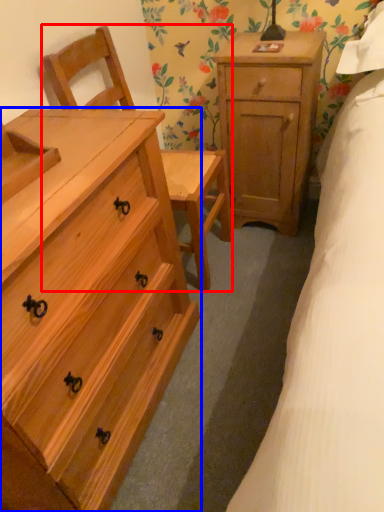
Question: Which object is closer to the camera taking this photo, armchair (highlighted by a red box) or chest of drawers (highlighted by a blue box)?

Choices:
 (A) armchair
 (B) chest of drawers

Answer: (B)